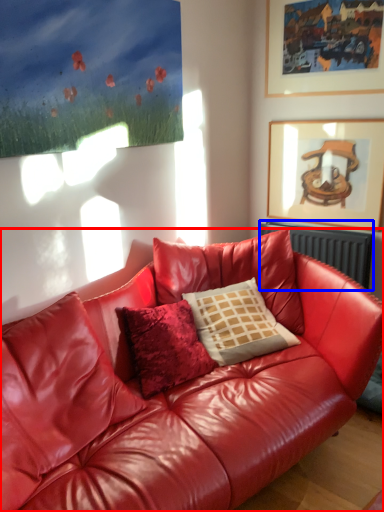
Question: Which object appears closest to the camera in this image, studio couch (highlighted by a red box) or radiator (highlighted by a blue box)?

Choices:
 (A) studio couch
 (B) radiator

Answer: (A)